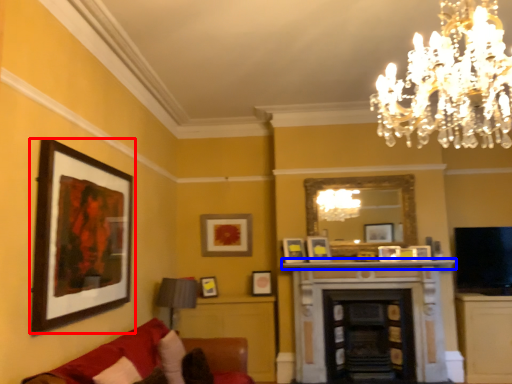
Question: Which of the following is the closest to the observer, picture frame (highlighted by a red box) or mantle (highlighted by a blue box)?

Choices:
 (A) picture frame
 (B) mantle

Answer: (A)